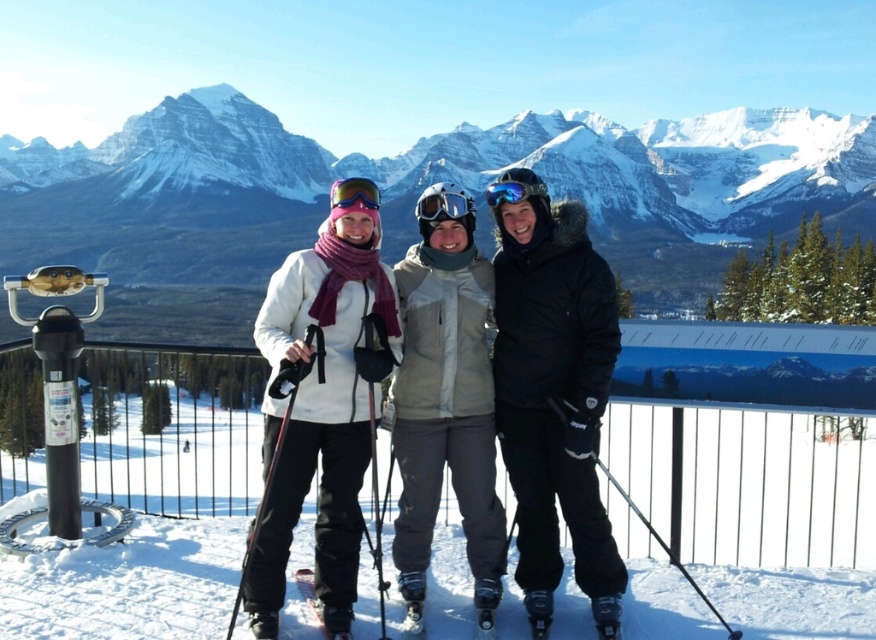
Question: Based on their relative distances, which object is nearer to the transparent plastic goggles at center?

Choices:
 (A) matte black jacket at center
 (B) white fleece jacket at center

Answer: (B)

Question: Can you confirm if white fleece jacket at center is wider than transparent plastic goggles at center?

Choices:
 (A) no
 (B) yes

Answer: (B)

Question: Does matte black jacket at center appear over matte blue goggles at center?

Choices:
 (A) yes
 (B) no

Answer: (B)

Question: Does transparent plastic goggles at center have a larger size compared to matte blue goggles at center?

Choices:
 (A) no
 (B) yes

Answer: (A)

Question: Which object appears farthest from the camera in this image?

Choices:
 (A) blue reflective lens goggles at center
 (B) matte blue goggles at center

Answer: (A)

Question: Which point is closer to the camera?

Choices:
 (A) (507, 426)
 (B) (443, 212)
 (C) (338, 205)
 (D) (539, 188)

Answer: (A)